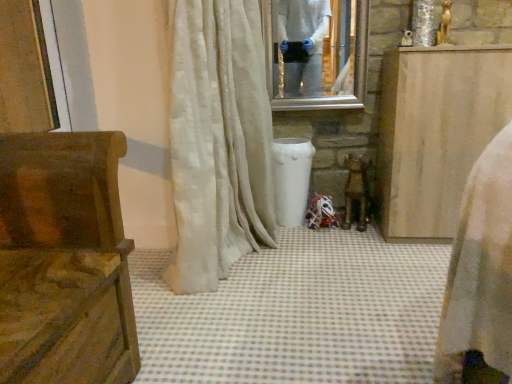
Question: Considering the relative sizes of white silky curtain at center and clear glass mirror at upper center in the image provided, is white silky curtain at center shorter than clear glass mirror at upper center?

Choices:
 (A) no
 (B) yes

Answer: (A)

Question: Is white silky curtain at center aimed at clear glass mirror at upper center?

Choices:
 (A) yes
 (B) no

Answer: (A)

Question: From the image's perspective, does white silky curtain at center appear higher than clear glass mirror at upper center?

Choices:
 (A) yes
 (B) no

Answer: (B)

Question: From a real-world perspective, is white silky curtain at center positioned over clear glass mirror at upper center based on gravity?

Choices:
 (A) no
 (B) yes

Answer: (A)

Question: From the image's perspective, would you say white silky curtain at center is shown under clear glass mirror at upper center?

Choices:
 (A) no
 (B) yes

Answer: (B)

Question: In terms of size, does wooden at center appear bigger or smaller than white silky curtain at center?

Choices:
 (A) big
 (B) small

Answer: (B)

Question: Would you say wooden at center is to the left or to the right of white silky curtain at center in the picture?

Choices:
 (A) right
 (B) left

Answer: (A)

Question: From the image's perspective, relative to white silky curtain at center, is wooden at center above or below?

Choices:
 (A) below
 (B) above

Answer: (A)

Question: From a real-world perspective, relative to white silky curtain at center, is wooden at center vertically above or below?

Choices:
 (A) below
 (B) above

Answer: (A)

Question: From a real-world perspective, relative to clear glass mirror at upper center, is light brown wood cabinet at right, which appears as the second furniture when viewed from the left, vertically above or below?

Choices:
 (A) above
 (B) below

Answer: (B)

Question: Is point (446, 145) closer or farther from the camera than point (321, 19)?

Choices:
 (A) closer
 (B) farther

Answer: (A)

Question: From the image's perspective, is light brown wood cabinet at right, the first furniture viewed from the back, located above or below clear glass mirror at upper center?

Choices:
 (A) above
 (B) below

Answer: (B)

Question: In terms of height, does light brown wood cabinet at right, arranged as the first furniture when viewed from the right, look taller or shorter compared to clear glass mirror at upper center?

Choices:
 (A) short
 (B) tall

Answer: (B)

Question: In the image, is white silky curtain at center positioned in front of or behind wooden carved bench at left, the first furniture when ordered from front to back?

Choices:
 (A) front
 (B) behind

Answer: (B)

Question: From the image's perspective, is white silky curtain at center located above or below wooden carved bench at left, arranged as the 1th furniture when viewed from the left?

Choices:
 (A) below
 (B) above

Answer: (B)